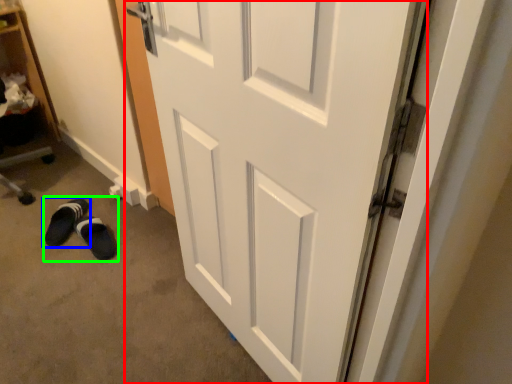
Question: Which object is the closest to the door (highlighted by a red box)? Choose among these: footwear (highlighted by a blue box) or shoe (highlighted by a green box).

Choices:
 (A) footwear
 (B) shoe

Answer: (B)